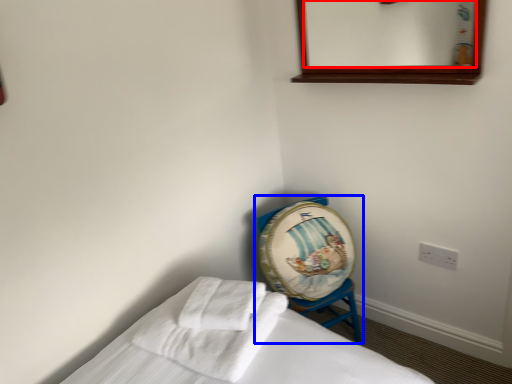
Question: Which point is closer to the camera, mirror (highlighted by a red box) or furniture (highlighted by a blue box)?

Choices:
 (A) mirror
 (B) furniture

Answer: (A)